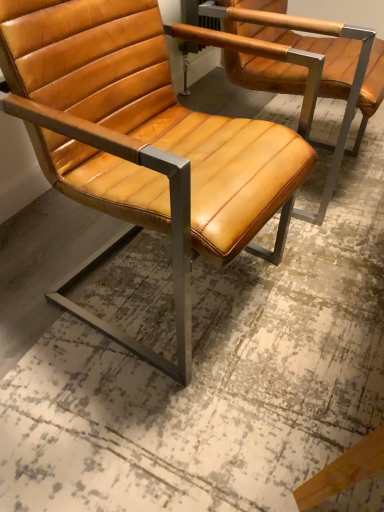
Question: Should I look upward or downward to see matte leather chair at center?

Choices:
 (A) up
 (B) down

Answer: (A)